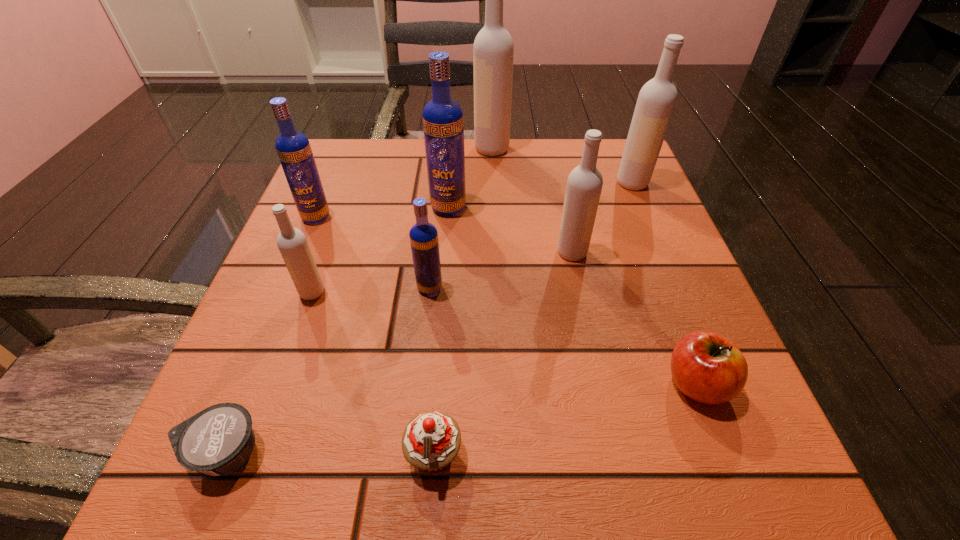
Find the location of `unoccupied position between the red apple and the pink cupcake`. unoccupied position between the red apple and the pink cupcake is located at coordinates (565, 419).

Locate an element on the screen. The height and width of the screenshot is (540, 960). vacant area that lies between the eighth farthest object and the fifth farthest object is located at coordinates (635, 318).

Identify the location of free space between the rightmost vodka and the leftmost white vodka. This screenshot has height=540, width=960. (472, 238).

Where is `vacant point located between the second smallest blue vodka and the third smallest white vodka`? vacant point located between the second smallest blue vodka and the third smallest white vodka is located at coordinates (474, 200).

In order to click on free space between the smallest blue vodka and the tallest vodka in this screenshot , I will do `click(461, 218)`.

Identify the location of free space between the smallest white vodka and the red apple. (504, 338).

Locate an element on the screen. The width and height of the screenshot is (960, 540). free space between the eighth object from left to right and the second biggest blue vodka is located at coordinates (444, 234).

The width and height of the screenshot is (960, 540). I want to click on free space between the cupcake and the shortest object, so click(329, 453).

Select which object appears as the eighth closest to the biggest white vodka. Please provide its 2D coordinates. Your answer should be formatted as a tuple, i.e. [(x, y)], where the tuple contains the x and y coordinates of a point satisfying the conditions above.

[(431, 440)]

The height and width of the screenshot is (540, 960). What are the coordinates of `object that can be found as the closest to the pink cupcake` in the screenshot? It's located at (219, 439).